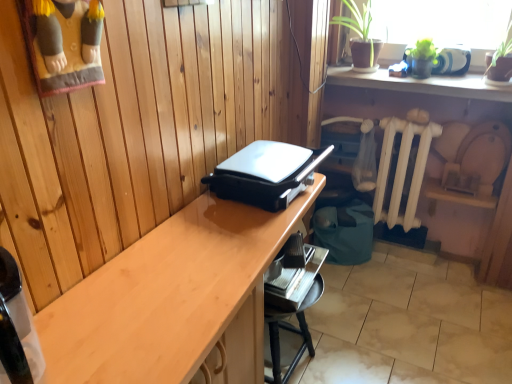
This screenshot has width=512, height=384. What are the coordinates of `free space in front of black plastic waffle iron at center` in the screenshot? It's located at (226, 243).